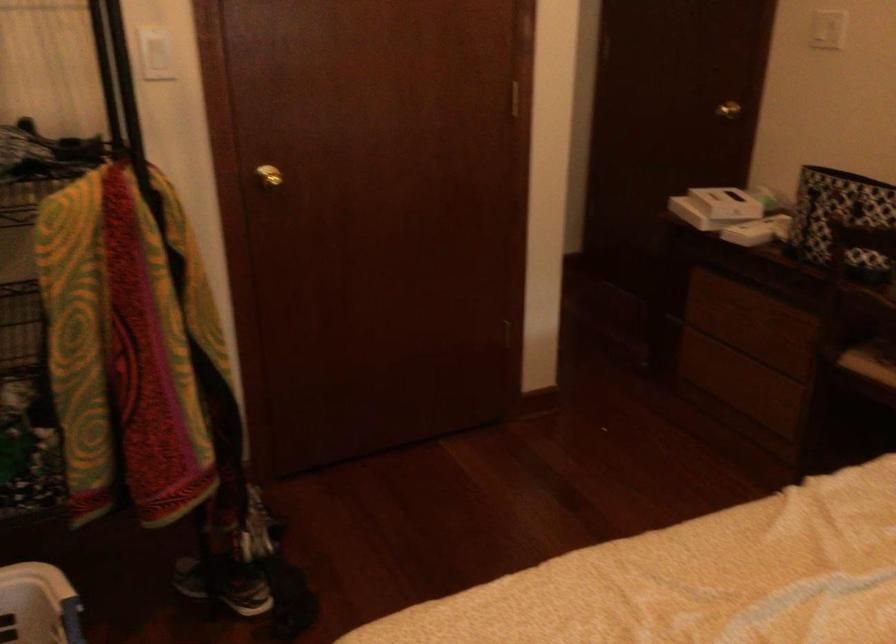
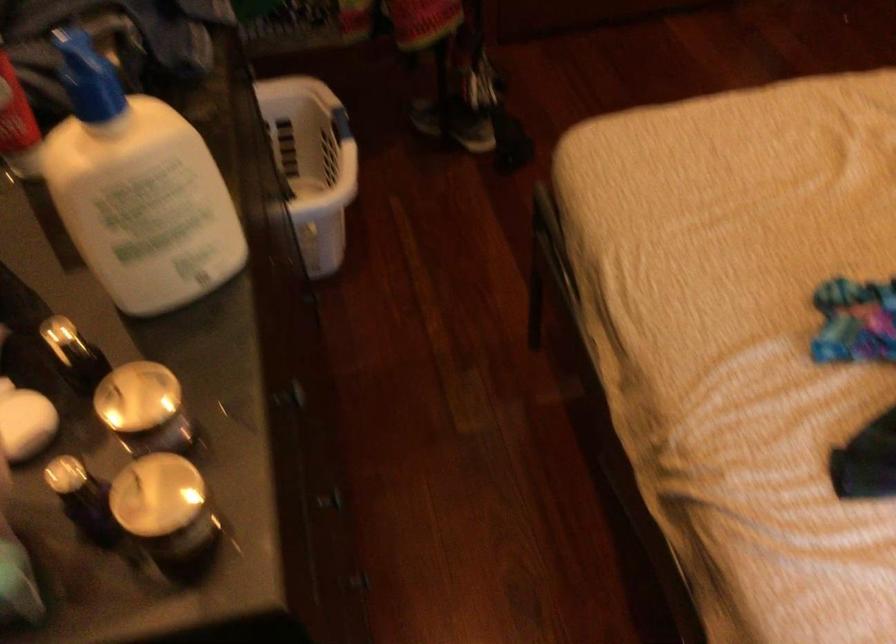
Question: The images are taken continuously from a first-person perspective. In which direction is your viewpoint rotating?

Choices:
 (A) Left
 (B) Right
 (C) Up
 (D) Down

Answer: (D)